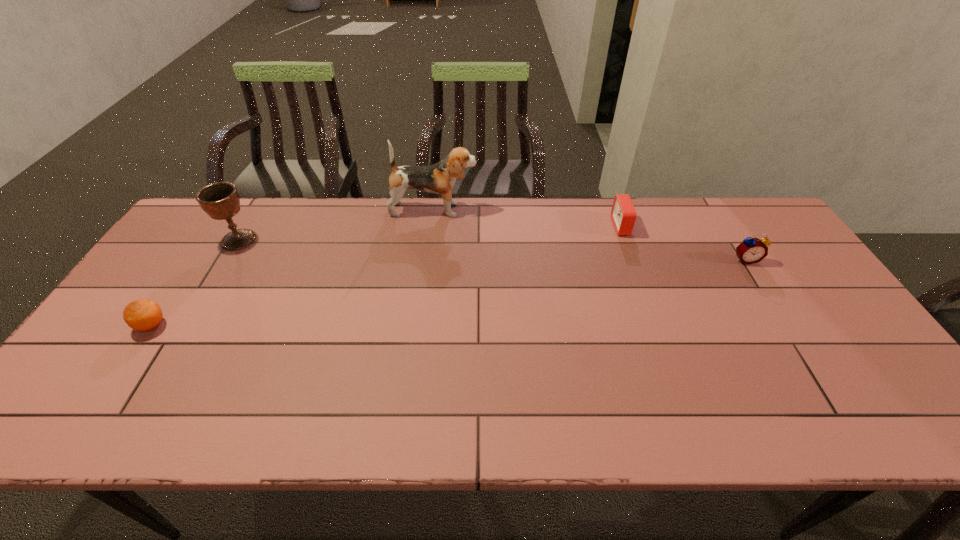
Where is `blank area located on the front-facing side of the right alarm clock`? This screenshot has width=960, height=540. blank area located on the front-facing side of the right alarm clock is located at coordinates (814, 370).

The width and height of the screenshot is (960, 540). Find the location of `vacant area situated 0.350m on the front-facing side of the left alarm clock`. vacant area situated 0.350m on the front-facing side of the left alarm clock is located at coordinates (505, 226).

What are the coordinates of `free location located on the front-facing side of the left alarm clock` in the screenshot? It's located at (569, 226).

Where is `free space located on the front-facing side of the left alarm clock`? free space located on the front-facing side of the left alarm clock is located at coordinates (561, 226).

Find the location of a particular element. The height and width of the screenshot is (540, 960). vacant space situated on the front of the nearest object is located at coordinates (128, 361).

At what (x,y) coordinates should I click in order to perform the action: click on puppy located in the far edge section of the desktop. Please return your answer as a coordinate pair (x, y). This screenshot has width=960, height=540. Looking at the image, I should click on (439, 178).

Locate an element on the screen. This screenshot has width=960, height=540. chalice located in the far edge section of the desktop is located at coordinates (220, 200).

The height and width of the screenshot is (540, 960). Identify the location of alarm clock situated at the far edge. [x=623, y=214].

I want to click on chalice that is at the left edge, so click(220, 200).

You are a GUI agent. You are given a task and a screenshot of the screen. Output one action in this format:
    pyautogui.click(x=<x>, y=<y>)
    Task: Click on the orange present at the left edge
    This screenshot has height=540, width=960.
    Given the screenshot: What is the action you would take?
    pyautogui.click(x=143, y=315)